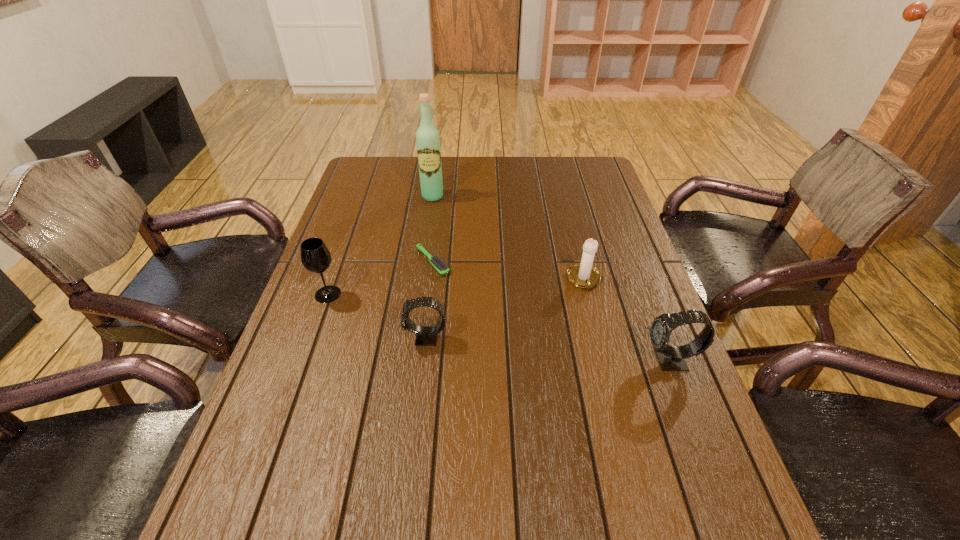
At what (x,y) coordinates should I click in order to perform the action: click on free space located 0.160m on the face of the shorter watch. Please return your answer as a coordinate pair (x, y). The height and width of the screenshot is (540, 960). Looking at the image, I should click on (337, 338).

Locate an element on the screen. This screenshot has width=960, height=540. vacant area located 0.060m on the face of the taller watch is located at coordinates (618, 361).

Where is `free space located on the face of the taller watch`? The width and height of the screenshot is (960, 540). free space located on the face of the taller watch is located at coordinates (x=520, y=361).

This screenshot has height=540, width=960. Find the location of `vacant space located 0.110m on the face of the taller watch`. vacant space located 0.110m on the face of the taller watch is located at coordinates [x=596, y=361].

Find the location of a particular element. vacant space located on the back of the hairbrush is located at coordinates (438, 221).

Identify the location of free space located on the back of the leftmost object. (358, 208).

Identify the location of blank space located on the front-facing side of the farthest object. The image size is (960, 540). (420, 279).

Find the location of a particular element. vacant space located on the handle side of the fifth object from left to right is located at coordinates (607, 371).

I want to click on object that is at the far edge, so click(x=427, y=136).

This screenshot has width=960, height=540. In order to click on object at the left edge in this screenshot , I will do `click(315, 256)`.